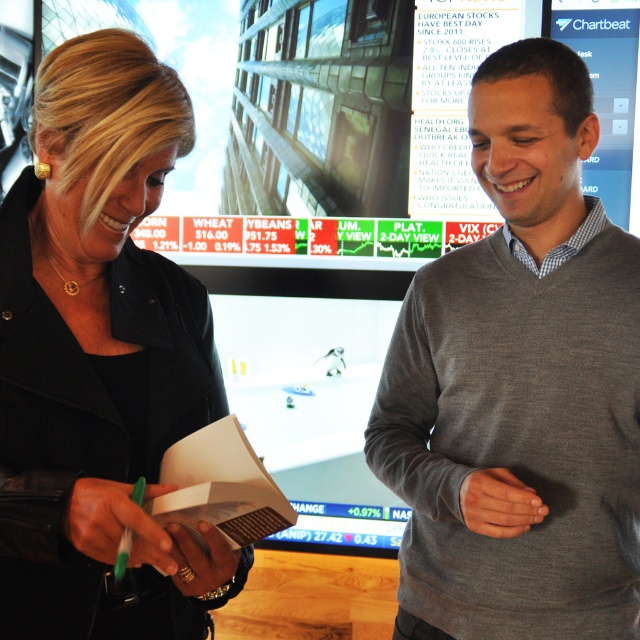
Question: Is gray sweater at center to the right of black matte jacket at left from the viewer's perspective?

Choices:
 (A) yes
 (B) no

Answer: (A)

Question: Where is gray sweater at center located in relation to black matte jacket at left in the image?

Choices:
 (A) right
 (B) left

Answer: (A)

Question: Does gray sweater at center lie behind black matte jacket at left?

Choices:
 (A) yes
 (B) no

Answer: (A)

Question: Which object is farther from the camera taking this photo?

Choices:
 (A) black matte jacket at left
 (B) gray sweater at center

Answer: (B)